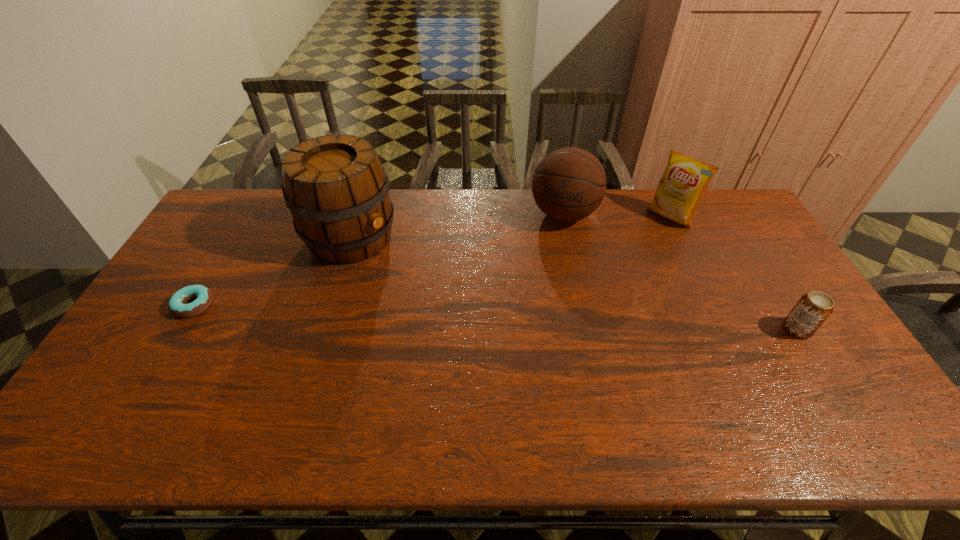
I want to click on vacant space positioned 0.140m on the side of the tallest object where the spigot is located, so click(414, 277).

I want to click on vacant region located 0.080m on the side of the tallest object where the spigot is located, so click(x=400, y=268).

In order to click on vacant area situated on the side of the tallest object where the spigot is located in this screenshot , I will do `click(464, 309)`.

Identify the location of vacant space situated on the side with brand label of the third object from right to left. (527, 319).

Identify the location of free location located on the side with brand label of the third object from right to left. (544, 269).

Identify the location of vacant space located 0.110m on the side with brand label of the third object from right to left. The height and width of the screenshot is (540, 960). (549, 256).

Locate an element on the screen. The image size is (960, 540). vacant area situated on the front-facing side of the crisp (potato chip) is located at coordinates (622, 265).

This screenshot has width=960, height=540. I want to click on free region located 0.230m on the front-facing side of the crisp (potato chip), so click(627, 260).

The width and height of the screenshot is (960, 540). I want to click on vacant space located on the front-facing side of the crisp (potato chip), so click(601, 285).

The width and height of the screenshot is (960, 540). I want to click on cider located at the far edge, so click(x=337, y=190).